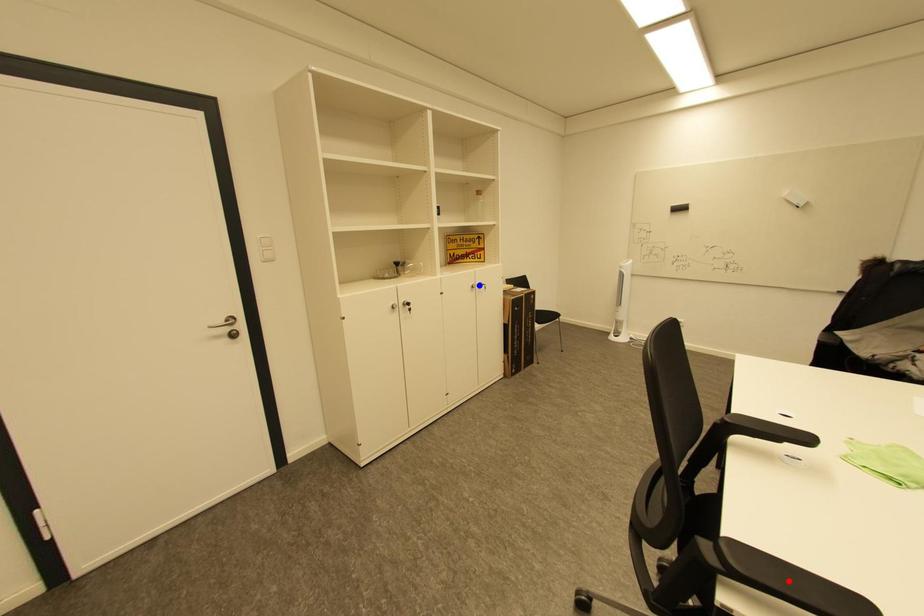
Question: Which of the two points in the image is closer to the camera?

Choices:
 (A) Blue point is closer.
 (B) Red point is closer.

Answer: (B)